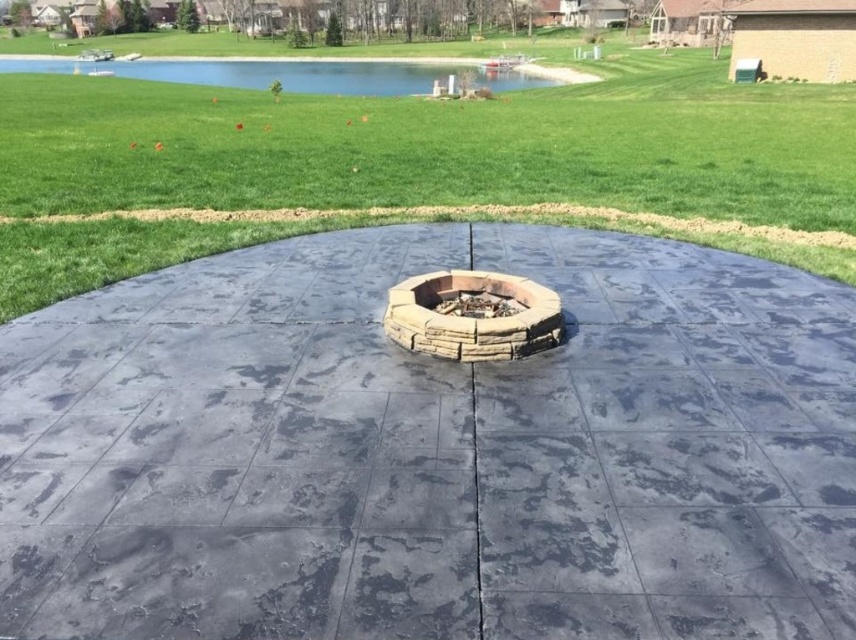
Consider the image. Is gray concrete fire pit at center positioned at the back of stone textured fire pit at center?

No, gray concrete fire pit at center is in front of stone textured fire pit at center.

Does gray concrete fire pit at center have a larger size compared to stone textured fire pit at center?

Yes, gray concrete fire pit at center is bigger than stone textured fire pit at center.

Where is `gray concrete fire pit at center`? This screenshot has width=856, height=640. gray concrete fire pit at center is located at coordinates (432, 451).

Is green grass at center shorter than stone textured fire pit at center?

Incorrect, green grass at center's height does not fall short of stone textured fire pit at center's.

Does green grass at center appear under stone textured fire pit at center?

No, green grass at center is not below stone textured fire pit at center.

The image size is (856, 640). What do you see at coordinates (397, 160) in the screenshot?
I see `green grass at center` at bounding box center [397, 160].

Identify the location of green grass at center. point(397,160).

Does gray concrete fire pit at center have a greater width compared to green grass at center?

No.

Who is lower down, gray concrete fire pit at center or green grass at center?

gray concrete fire pit at center is lower down.

Where is `gray concrete fire pit at center`? The height and width of the screenshot is (640, 856). gray concrete fire pit at center is located at coordinates (432, 451).

You are a GUI agent. You are given a task and a screenshot of the screen. Output one action in this format:
    pyautogui.click(x=<x>, y=<y>)
    Task: Click on the gray concrete fire pit at center
    The height and width of the screenshot is (640, 856).
    Given the screenshot: What is the action you would take?
    pyautogui.click(x=432, y=451)